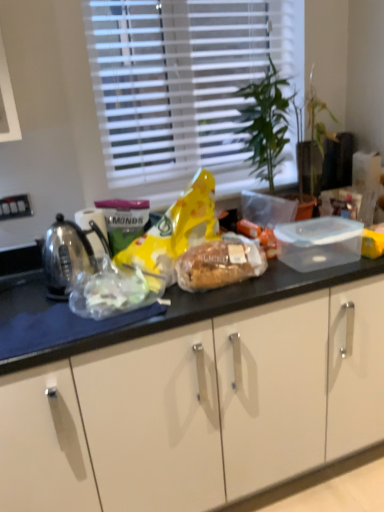
Question: Considering the relative sizes of white blinds at upper center and polished stainless steel kettle at left in the image provided, is white blinds at upper center wider than polished stainless steel kettle at left?

Choices:
 (A) yes
 (B) no

Answer: (B)

Question: Considering the relative positions of white blinds at upper center and polished stainless steel kettle at left in the image provided, is white blinds at upper center to the left of polished stainless steel kettle at left from the viewer's perspective?

Choices:
 (A) no
 (B) yes

Answer: (A)

Question: Considering the relative sizes of white blinds at upper center and polished stainless steel kettle at left in the image provided, is white blinds at upper center thinner than polished stainless steel kettle at left?

Choices:
 (A) no
 (B) yes

Answer: (B)

Question: From a real-world perspective, is white blinds at upper center on polished stainless steel kettle at left?

Choices:
 (A) no
 (B) yes

Answer: (B)

Question: Can you confirm if white blinds at upper center is bigger than polished stainless steel kettle at left?

Choices:
 (A) yes
 (B) no

Answer: (A)

Question: Is polished stainless steel kettle at left wider or thinner than translucent plastic bag at left?

Choices:
 (A) thin
 (B) wide

Answer: (A)

Question: In terms of height, does polished stainless steel kettle at left look taller or shorter compared to translucent plastic bag at left?

Choices:
 (A) tall
 (B) short

Answer: (A)

Question: Would you say polished stainless steel kettle at left is inside or outside translucent plastic bag at left?

Choices:
 (A) inside
 (B) outside

Answer: (B)

Question: Based on their positions, is polished stainless steel kettle at left located to the left or right of translucent plastic bag at left?

Choices:
 (A) right
 (B) left

Answer: (B)

Question: Based on their sizes in the image, would you say white blinds at upper center is bigger or smaller than translucent plastic bag at left?

Choices:
 (A) big
 (B) small

Answer: (A)

Question: Is white blinds at upper center inside the boundaries of translucent plastic bag at left, or outside?

Choices:
 (A) inside
 (B) outside

Answer: (B)

Question: From their relative heights in the image, would you say white blinds at upper center is taller or shorter than translucent plastic bag at left?

Choices:
 (A) tall
 (B) short

Answer: (A)

Question: From a real-world perspective, relative to translucent plastic bag at left, is white blinds at upper center vertically above or below?

Choices:
 (A) above
 (B) below

Answer: (A)

Question: Considering the positions of point (119, 310) and point (56, 253), is point (119, 310) closer or farther from the camera than point (56, 253)?

Choices:
 (A) closer
 (B) farther

Answer: (A)

Question: From a real-world perspective, is translucent plastic bag at left above or below polished stainless steel kettle at left?

Choices:
 (A) below
 (B) above

Answer: (A)